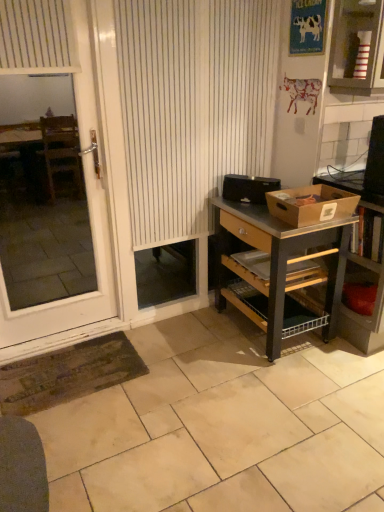
Find the location of a particular element. This screenshot has width=384, height=512. free region under black plastic toaster at center, positioned as the second box in front-to-back order (from a real-world perspective) is located at coordinates (244, 198).